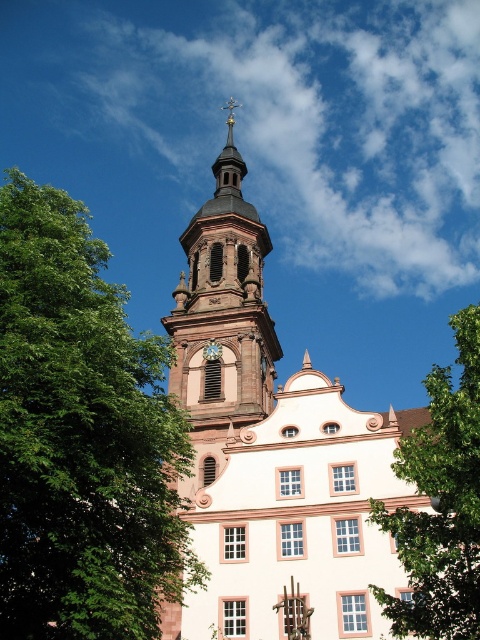
Question: Does green leafy tree at right appear on the left side of metallic gold clock at center?

Choices:
 (A) yes
 (B) no

Answer: (B)

Question: Can you confirm if green leafy tree at upper left is thinner than green leafy tree at right?

Choices:
 (A) yes
 (B) no

Answer: (A)

Question: Which of these objects is positioned closest to the white stone church at center?

Choices:
 (A) metallic gold clock at center
 (B) smooth gold tower at center
 (C) green leafy tree at upper left
 (D) green leafy tree at right

Answer: (B)

Question: Does green leafy tree at upper left come in front of white stone church at center?

Choices:
 (A) no
 (B) yes

Answer: (B)

Question: Which object appears closest to the camera in this image?

Choices:
 (A) green leafy tree at right
 (B) white stone church at center
 (C) metallic gold clock at center

Answer: (A)

Question: Estimate the real-world distances between objects in this image. Which object is farther from the green leafy tree at right?

Choices:
 (A) metallic gold clock at center
 (B) green leafy tree at upper left
 (C) smooth gold tower at center
 (D) white stone church at center

Answer: (C)